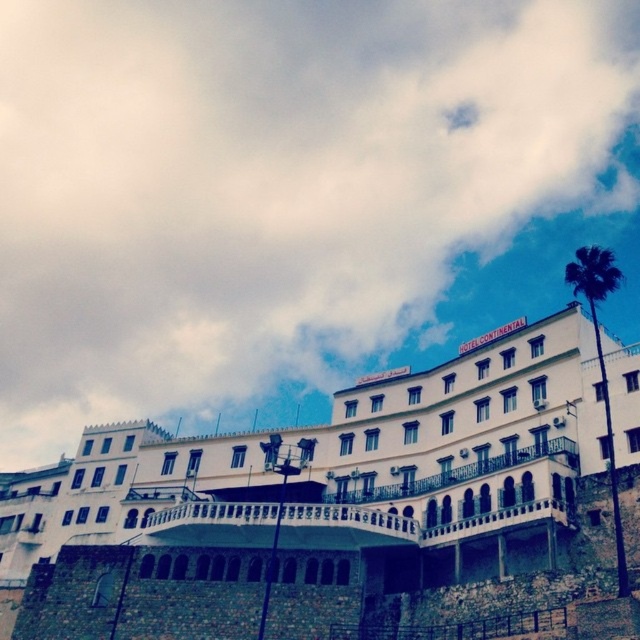
In the scene shown: You are standing in front of the hotel and want to take a photo that includes both the white stone building at center and the green leafy palm at upper right. Based on their positions, where should you position the palm in relation to the building in your photo?

The green leafy palm at upper right is positioned above the white stone building at center, so in your photo, the palm should be placed higher up relative to the building to capture both elements effectively.

You are standing in a park across from the white stone building at center. You want to take a photo of it but need to know if you can fit the entire building into your camera frame. Your camera has a maximum viewable distance of 40 meters. Can you capture the building entirely?

The white stone building at center is 39.97 meters away from the viewer, which is within the camera maximum viewable distance of 40 meters. Therefore, you can capture the entire building in your camera frame.

You are a guest staying at the HOTEL CONTINENTAL and want to take a photo of the white stone building at center and the green leafy palm at upper right from the front lawn. Which object should you position closer to the camera to ensure both are in the frame?

A: The white stone building at center has a smaller size compared to green leafy palm at upper right. To ensure both are in the frame, position the white stone building at center closer to the camera since it is smaller and needs to be enlarged in the photo to balance with the larger palm.